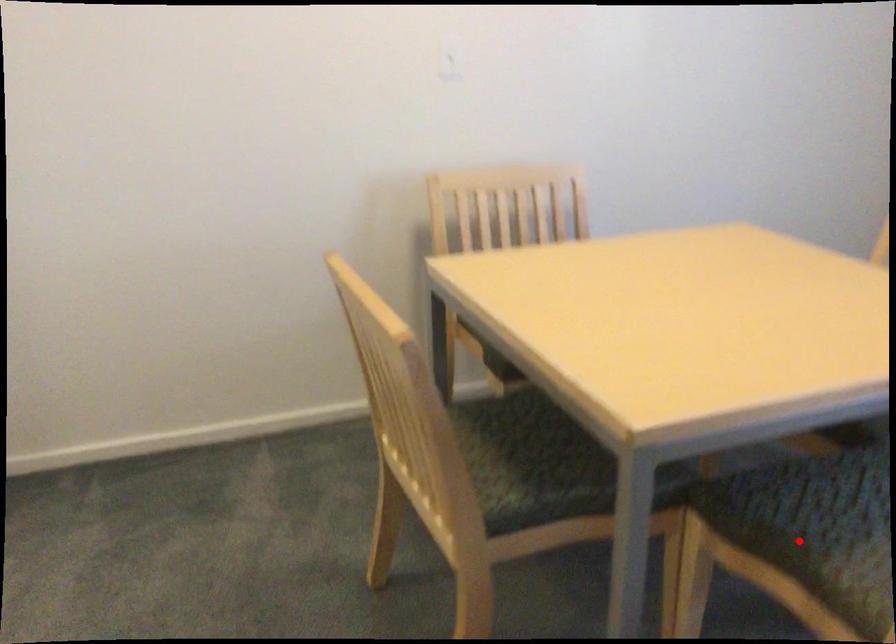
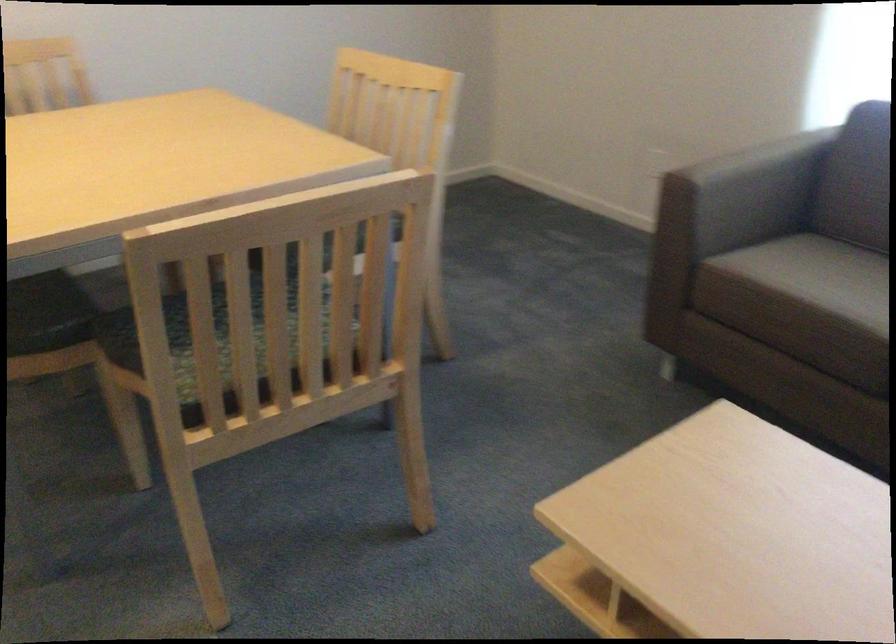
Question: I am providing you with two images of the same scene from different viewpoints. A red point is marked on the first image. Can you still see the location of the red point in image 2?

Choices:
 (A) Yes
 (B) No

Answer: (B)